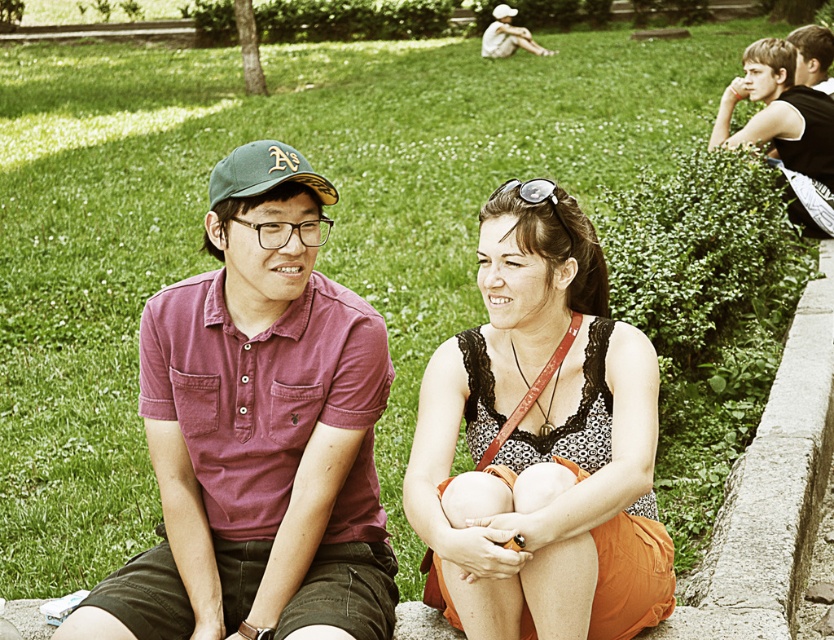
Question: Does orange lace dress at center have a larger size compared to smooth black shirt at upper right?

Choices:
 (A) yes
 (B) no

Answer: (B)

Question: Estimate the real-world distances between objects in this image. Which object is farther from the matte cotton polo shirt at center?

Choices:
 (A) orange lace dress at center
 (B) smooth black shirt at upper right

Answer: (B)

Question: Can you confirm if orange lace dress at center is positioned below green fabric baseball cap at left?

Choices:
 (A) yes
 (B) no

Answer: (A)

Question: Observing the image, what is the correct spatial positioning of matte cotton polo shirt at center in reference to green fabric baseball cap at left?

Choices:
 (A) below
 (B) above

Answer: (A)

Question: Based on their relative distances, which object is nearer to the matte cotton polo shirt at center?

Choices:
 (A) orange lace dress at center
 (B) smooth black shirt at upper right

Answer: (A)

Question: Which is farther from the orange lace dress at center?

Choices:
 (A) green fabric baseball cap at left
 (B) smooth black shirt at upper right
 (C) matte cotton polo shirt at center

Answer: (B)